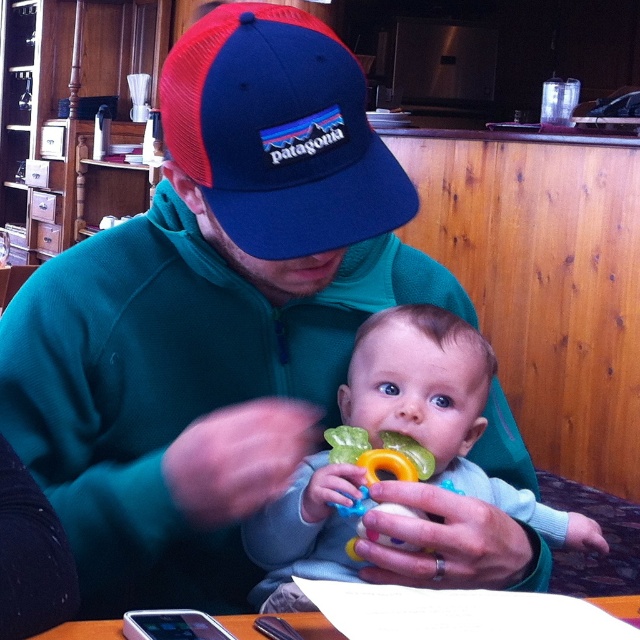
Question: Among these points, which one is farthest from the camera?

Choices:
 (A) (442, 573)
 (B) (333, 573)
 (C) (410, 458)

Answer: (B)

Question: Is light blue fabric baby at center behind wooden table at lower center?

Choices:
 (A) no
 (B) yes

Answer: (B)

Question: Does blue mesh baseball cap at upper center appear on the right side of translucent plastic teething ring at center?

Choices:
 (A) yes
 (B) no

Answer: (B)

Question: Which object is the farthest from the wooden table at lower center?

Choices:
 (A) light blue fabric baby at center
 (B) blue mesh baseball cap at upper center
 (C) translucent plastic teething ring at center
 (D) rubber/plastic teething ring at center

Answer: (B)

Question: Is light blue fabric baby at center smaller than rubber/plastic teething ring at center?

Choices:
 (A) no
 (B) yes

Answer: (A)

Question: Which point is farther to the camera?

Choices:
 (A) (340, 125)
 (B) (362, 451)
 (C) (440, 563)
 (D) (342, 547)

Answer: (D)